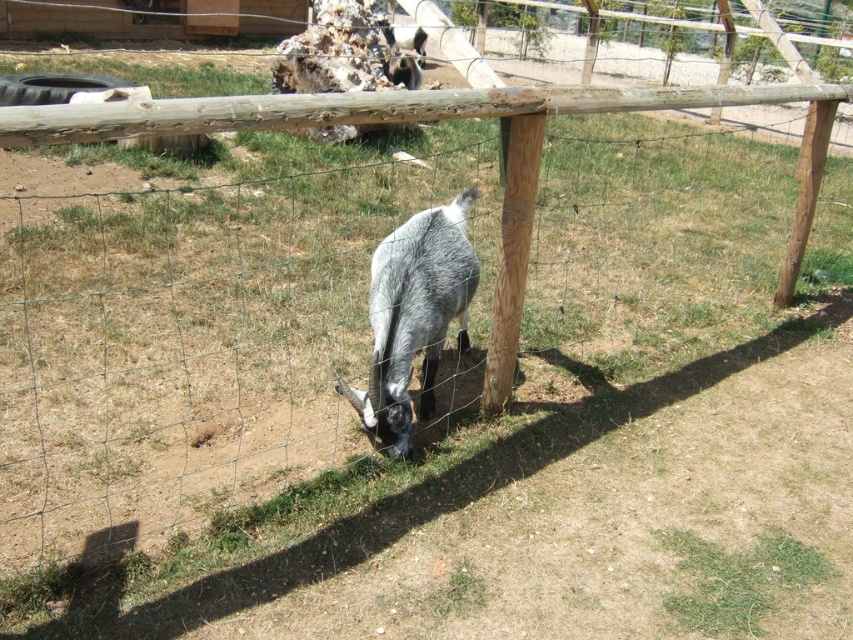
You are standing at the point labeled as point (512, 256) in the image. What object are you directly facing?

The point labeled as point (512, 256) directly faces the brown rough wooden post at center.

You are a farmer checking the enclosure for safety. You notice the brown rough wooden post at center and the fuzzy gray goat at center. Which object is smaller in size?

The brown rough wooden post at center is smaller in size compared to the fuzzy gray goat at center according to the description.